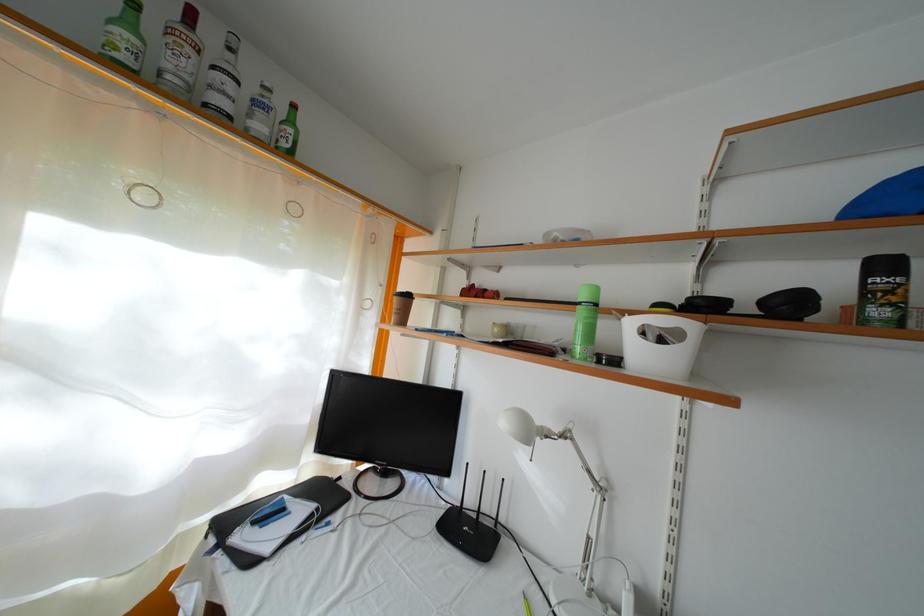
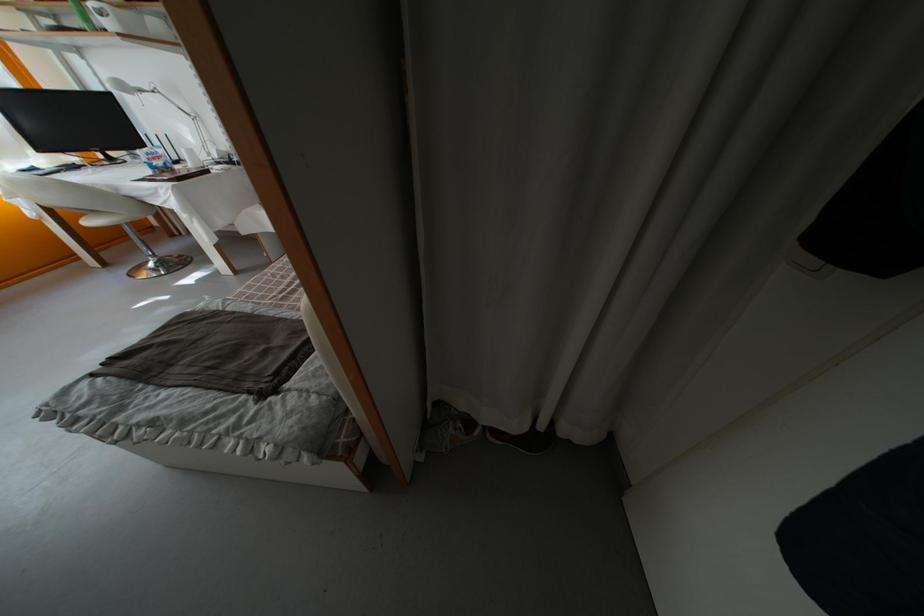
In the second image, find the point that corresponds to the point at 544,429 in the first image.

(139, 91)